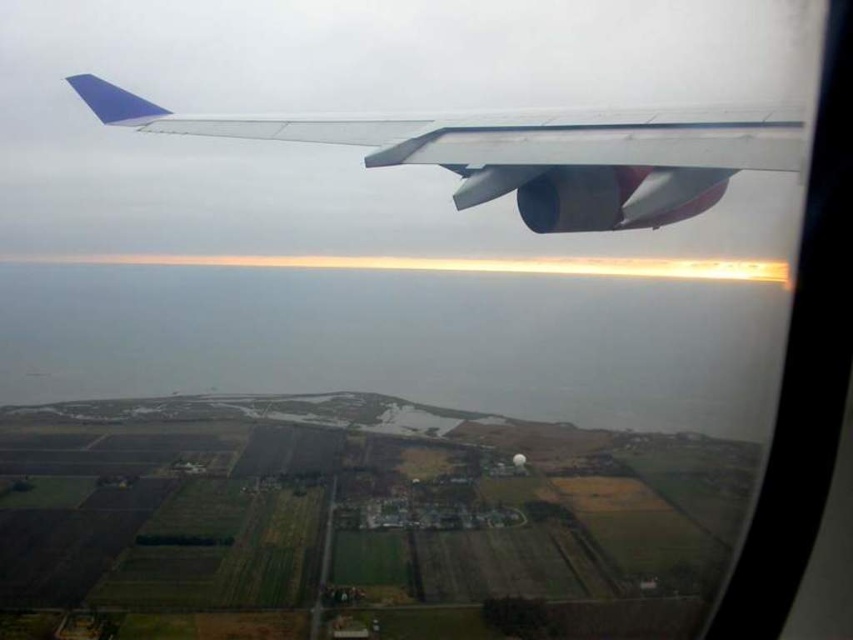
How much distance is there between green grassy fields at lower center and metallic silver wing at upper center?

green grassy fields at lower center is 650.01 meters away from metallic silver wing at upper center.

Is the position of green grassy fields at lower center less distant than that of metallic silver wing at upper center?

That is False.

Which is in front, point (503, 620) or point (534, 132)?

Point (534, 132)

Find the location of a particular element. The height and width of the screenshot is (640, 853). green grassy fields at lower center is located at coordinates (354, 522).